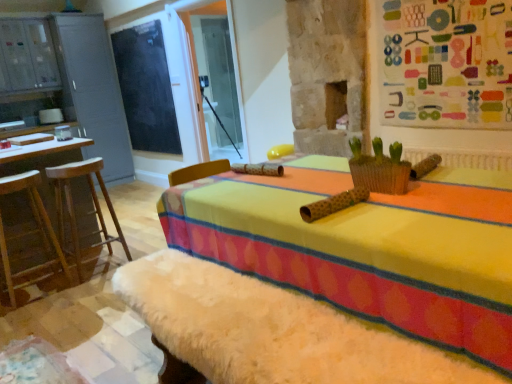
Question: Is blackboard at upper left inside or outside of wooden stool at left, the second furniture in the right-to-left sequence?

Choices:
 (A) outside
 (B) inside

Answer: (A)

Question: Would you say blackboard at upper left is to the left or to the right of wooden stool at left, the second furniture in the right-to-left sequence, in the picture?

Choices:
 (A) right
 (B) left

Answer: (A)

Question: Based on their relative distances, which object is farther from the blackboard at upper left?

Choices:
 (A) wooden stool at left, the second furniture in the right-to-left sequence
 (B) wooden bar stool at left, which appears as the 2th furniture when viewed from the left
 (C) woven brown basket at center
 (D) wooden barstools at left
 (E) matte gray cabinet at left

Answer: (C)

Question: Which object is the closest to the matte gray cabinet at left?

Choices:
 (A) blackboard at upper left
 (B) wooden stool at left, which appears as the first furniture when viewed from the left
 (C) wooden barstools at left
 (D) woven brown basket at center
 (E) wooden bar stool at left, the first furniture from the right

Answer: (A)